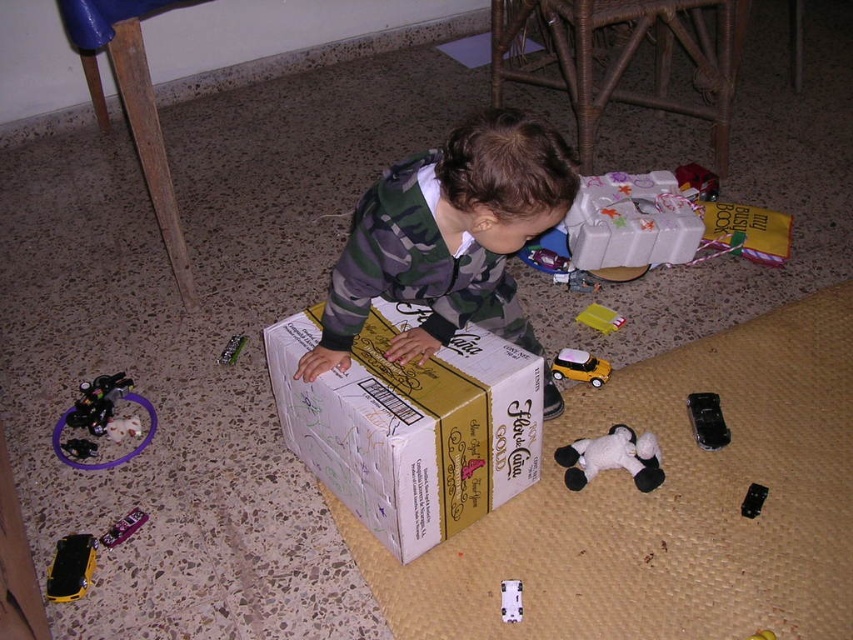
You are a parent trying to find a toy for your child. You see the camouflage fabric toddler at center and the metallic purple toy car at lower left. Which one is taller?

The camouflage fabric toddler at center is taller than the metallic purple toy car at lower left.

You are a parent trying to organize the playroom. You want to place the metallic black toy car at left closer to the plush pink teddy bear at center. How much distance do you need to reduce between them?

The metallic black toy car at left is currently 37.73 inches away from the plush pink teddy bear at center. To place them closer, you need to reduce the distance by 37.73 inches so that they are touching.

You are a parent trying to locate two specific points in the image of your child playing. The first point is at coordinate point (x=393, y=218) and the second is at coordinate point (x=132, y=528). Which of these two points is closer to you?

Point (x=393, y=218) is closer to the viewer than point (x=132, y=528).